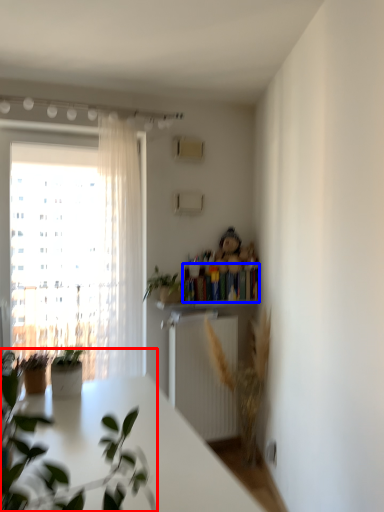
Question: Among these objects, which one is farthest to the camera, houseplant (highlighted by a red box) or book (highlighted by a blue box)?

Choices:
 (A) houseplant
 (B) book

Answer: (B)